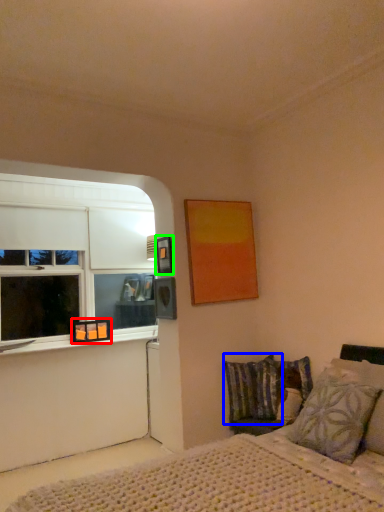
Question: Considering the real-world distances, which object is closest to picture frame (highlighted by a red box)? pillow (highlighted by a blue box) or picture frame (highlighted by a green box).

Choices:
 (A) pillow
 (B) picture frame

Answer: (B)